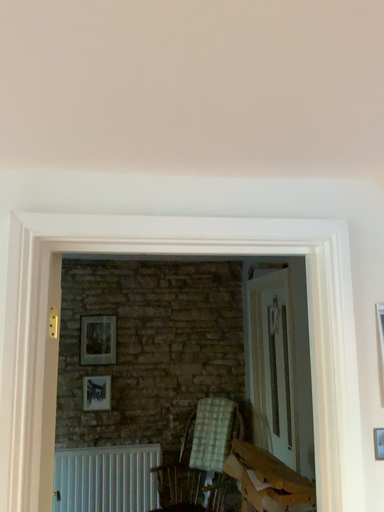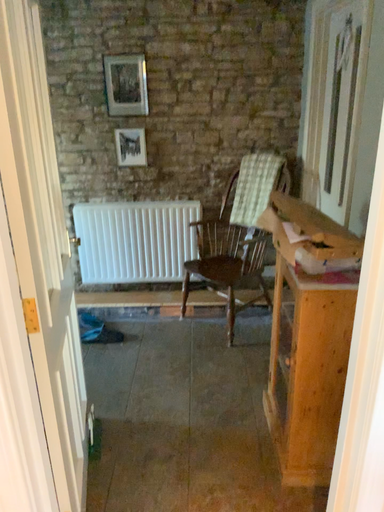
Question: Which way did the camera rotate in the video?

Choices:
 (A) rotated right
 (B) rotated left

Answer: (B)